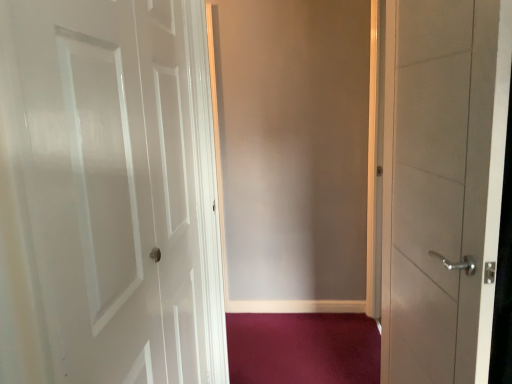
Question: Is matte gray screen door at center next to satin white door at right, marked as the first door in a right-to-left arrangement?

Choices:
 (A) yes
 (B) no

Answer: (B)

Question: Is matte gray screen door at center taller than satin white door at right, marked as the first door in a right-to-left arrangement?

Choices:
 (A) yes
 (B) no

Answer: (A)

Question: Considering the relative positions of matte gray screen door at center and satin white door at right, arranged as the second door when viewed from the left, in the image provided, is matte gray screen door at center to the right of satin white door at right, arranged as the second door when viewed from the left, from the viewer's perspective?

Choices:
 (A) yes
 (B) no

Answer: (B)

Question: Is matte gray screen door at center positioned in front of satin white door at right, arranged as the second door when viewed from the left?

Choices:
 (A) no
 (B) yes

Answer: (A)

Question: Does matte gray screen door at center have a lesser height compared to satin white door at right, arranged as the second door when viewed from the left?

Choices:
 (A) yes
 (B) no

Answer: (B)

Question: Do you think satin white door at right, arranged as the second door when viewed from the left, is within white glossy door at left, the second door from the right, or outside of it?

Choices:
 (A) inside
 (B) outside

Answer: (B)

Question: Relative to white glossy door at left, the second door from the right, is satin white door at right, marked as the first door in a right-to-left arrangement, in front or behind?

Choices:
 (A) front
 (B) behind

Answer: (B)

Question: Visually, is satin white door at right, marked as the first door in a right-to-left arrangement, positioned to the left or to the right of white glossy door at left, the first door in the left-to-right sequence?

Choices:
 (A) right
 (B) left

Answer: (A)

Question: From the image's perspective, is satin white door at right, marked as the first door in a right-to-left arrangement, located above or below white glossy door at left, the second door from the right?

Choices:
 (A) above
 (B) below

Answer: (A)

Question: Is point (57, 144) closer or farther from the camera than point (321, 41)?

Choices:
 (A) closer
 (B) farther

Answer: (A)

Question: Looking at their shapes, would you say white glossy door at left, the first door in the left-to-right sequence, is wider or thinner than matte gray screen door at center?

Choices:
 (A) thin
 (B) wide

Answer: (A)

Question: Based on their positions, is white glossy door at left, the second door from the right, located to the left or right of matte gray screen door at center?

Choices:
 (A) right
 (B) left

Answer: (B)

Question: Is white glossy door at left, the second door from the right, taller or shorter than matte gray screen door at center?

Choices:
 (A) short
 (B) tall

Answer: (A)

Question: Considering their positions, is satin white door at right, marked as the first door in a right-to-left arrangement, located in front of or behind purple carpet at lower center?

Choices:
 (A) front
 (B) behind

Answer: (A)

Question: Considering the positions of satin white door at right, arranged as the second door when viewed from the left, and purple carpet at lower center in the image, is satin white door at right, arranged as the second door when viewed from the left, taller or shorter than purple carpet at lower center?

Choices:
 (A) tall
 (B) short

Answer: (A)